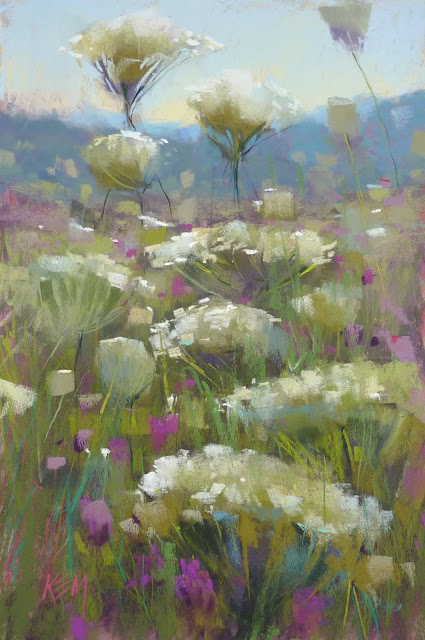
Where is `oil painting`? This screenshot has height=640, width=425. oil painting is located at coordinates (381, 614).